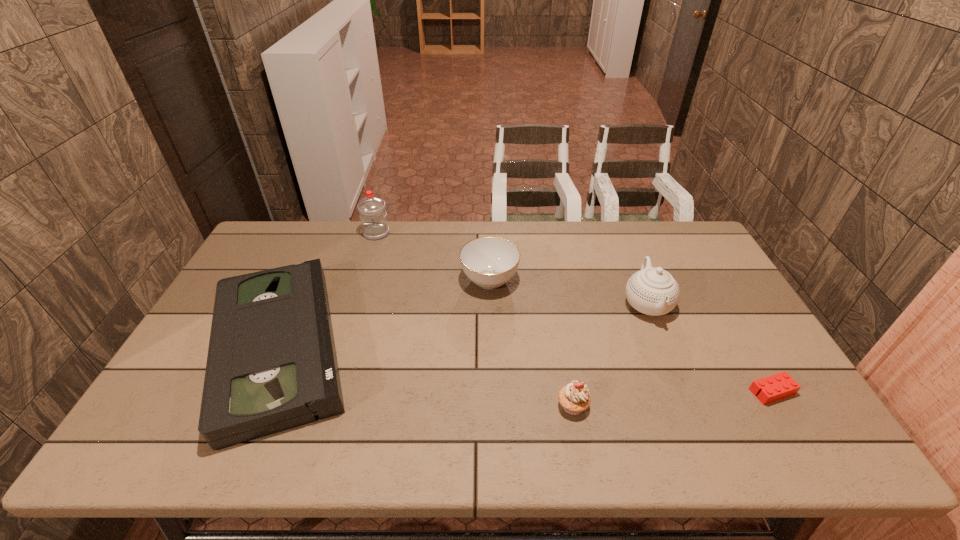
I want to click on free space between the videotape and the rightmost object, so click(x=526, y=369).

You are a GUI agent. You are given a task and a screenshot of the screen. Output one action in this format:
    pyautogui.click(x=<x>, y=<y>)
    Task: Click on the vacant area that lies between the shortest object and the water bottle
    
    Given the screenshot: What is the action you would take?
    pyautogui.click(x=574, y=312)

This screenshot has width=960, height=540. I want to click on free space between the shortest object and the videotape, so click(x=526, y=369).

You are a GUI agent. You are given a task and a screenshot of the screen. Output one action in this format:
    pyautogui.click(x=<x>, y=<y>)
    Task: Click on the vacant area that lies between the fourth object from left to right and the fourth shortest object
    This screenshot has width=960, height=540.
    Given the screenshot: What is the action you would take?
    (531, 343)

The width and height of the screenshot is (960, 540). What are the coordinates of `empty space between the fifth tallest object and the left chinaware` in the screenshot? It's located at (385, 314).

Locate an element on the screen. The height and width of the screenshot is (540, 960). object that is the second closest one to the left chinaware is located at coordinates (372, 212).

Identify which object is the nearest to the Lego. Please provide its 2D coordinates. Your answer should be formatted as a tuple, i.e. [(x, y)], where the tuple contains the x and y coordinates of a point satisfying the conditions above.

[(653, 291)]

Where is `free location that satisfies the following two spatial constraints: 1. on the handle side of the water bottle; 2. on the right side of the shorter chinaware`? free location that satisfies the following two spatial constraints: 1. on the handle side of the water bottle; 2. on the right side of the shorter chinaware is located at coordinates (362, 280).

What are the coordinates of `free spot that satisfies the following two spatial constraints: 1. on the handle side of the shortest object; 2. on the left side of the water bottle` in the screenshot? It's located at (328, 392).

Locate an element on the screen. vacant area that satisfies the following two spatial constraints: 1. on the spout of the shortest object; 2. on the right side of the fifth shortest object is located at coordinates (683, 392).